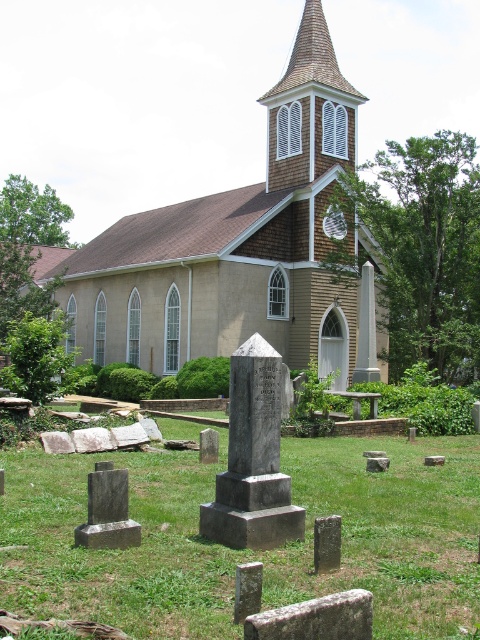
Is green grass at center below beige stucco church at center?

Correct, green grass at center is located below beige stucco church at center.

Which of these two, green grass at center or beige stucco church at center, stands taller?

beige stucco church at center

Does point (226, 604) come farther from viewer compared to point (358, 376)?

No.

The image size is (480, 640). What are the coordinates of `green grass at center` in the screenshot? It's located at (249, 548).